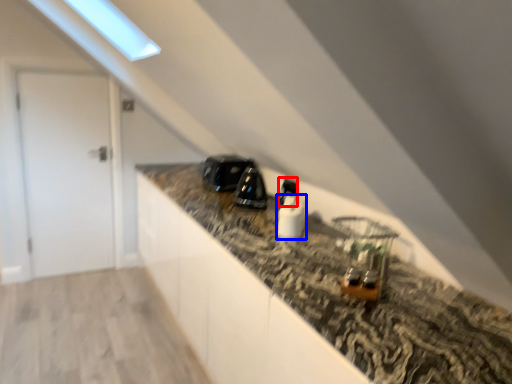
Question: Which of the following is the closest to the observer, appliance (highlighted by a red box) or appliance (highlighted by a blue box)?

Choices:
 (A) appliance
 (B) appliance

Answer: (B)